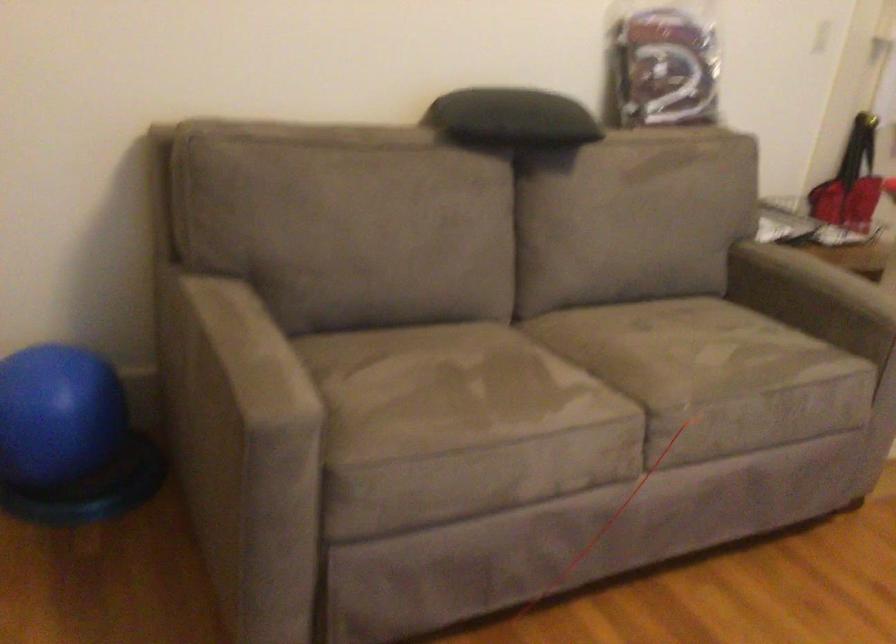
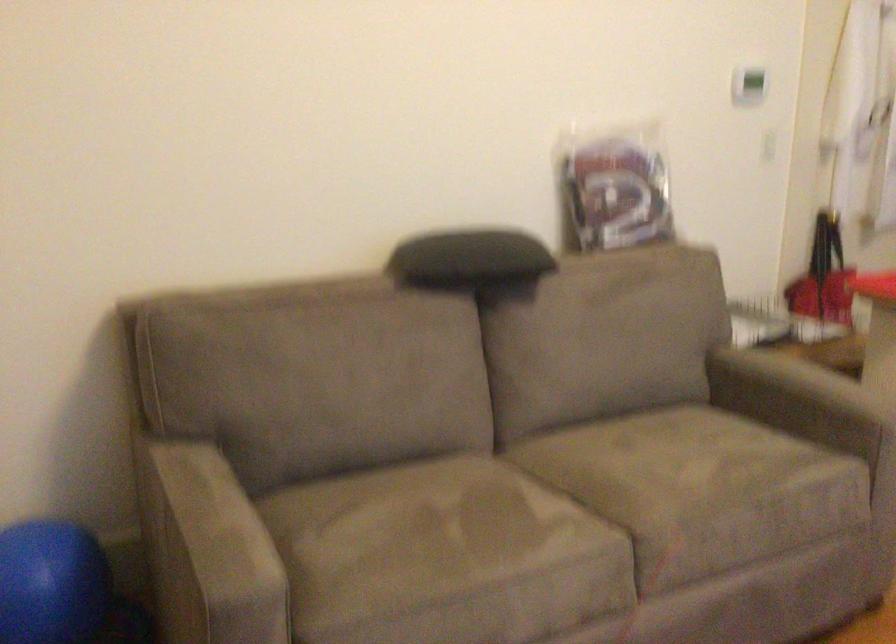
Question: Which direction would the cameraman need to move to produce the second image? Reply with the corresponding letter.

Choices:
 (A) Left
 (B) Right
 (C) Forward
 (D) Backward

Answer: (B)